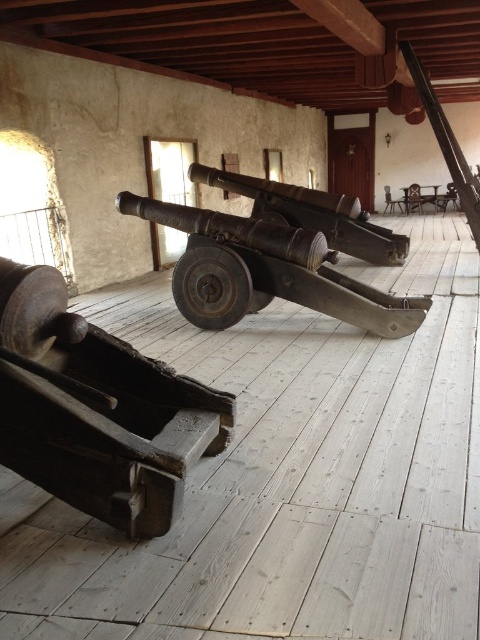
In the scene shown: You are a museum curator arranging an exhibition. You have two cannons to place in the room described. The cannons are labeled as the rusty metal cannon at lower left and the rusty metal cannon at center. Based on the spatial arrangement, which cannon is located to the left of the other?

The rusty metal cannon at lower left is positioned on the left side of the rusty metal cannon at center.

You are a tour guide leading a group through this historical exhibit. You need to move a small cart that is 4 feet wide between the two cannons. Can you fit the cart between the rusty metal cannon at lower left and the rusty metal cannon at center?

The distance between the rusty metal cannon at lower left and the rusty metal cannon at center is 8.13 feet. Since the cart is 4 feet wide, which is less than the 8.13 feet gap, the cart can fit between them.

You are an antique collector who wants to transport both cannons. You have a truck with a 2.5 meter width limit. Can you fit both rusty metal cannon at lower left and rusty metal cannon at center into the truck simultaneously without rotating them?

The rusty metal cannon at lower left is narrower than the rusty metal cannon at center. Since the truck has a 2.5 meter width limit, if the wider rusty metal cannon at center is less than 2.5 meters, both could fit side by side. However, without exact measurements, it is uncertain. The description only states the relative sizes, not absolute dimensions.